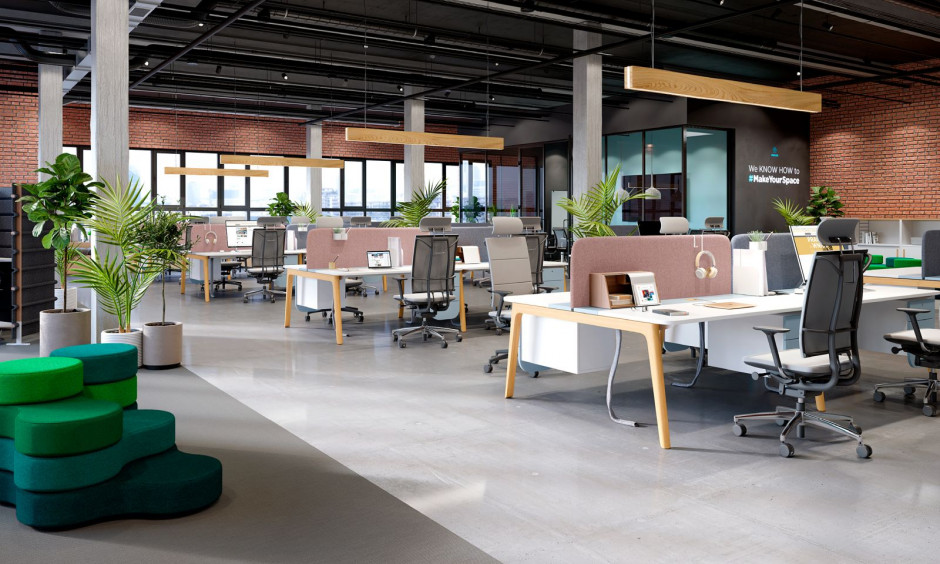
The image size is (940, 564). Find the location of `hanging lights`. hanging lights is located at coordinates (726, 89), (411, 147), (291, 164), (231, 177).